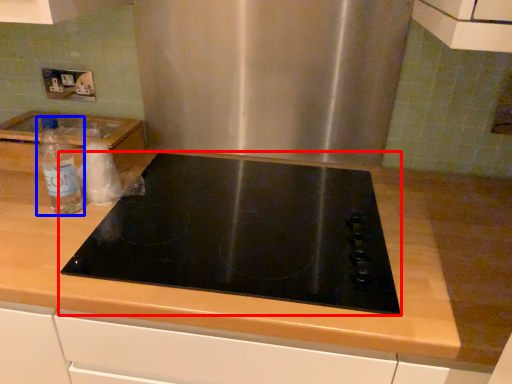
Question: Which object is further to the camera taking this photo, gas stove (highlighted by a red box) or bottle (highlighted by a blue box)?

Choices:
 (A) gas stove
 (B) bottle

Answer: (B)